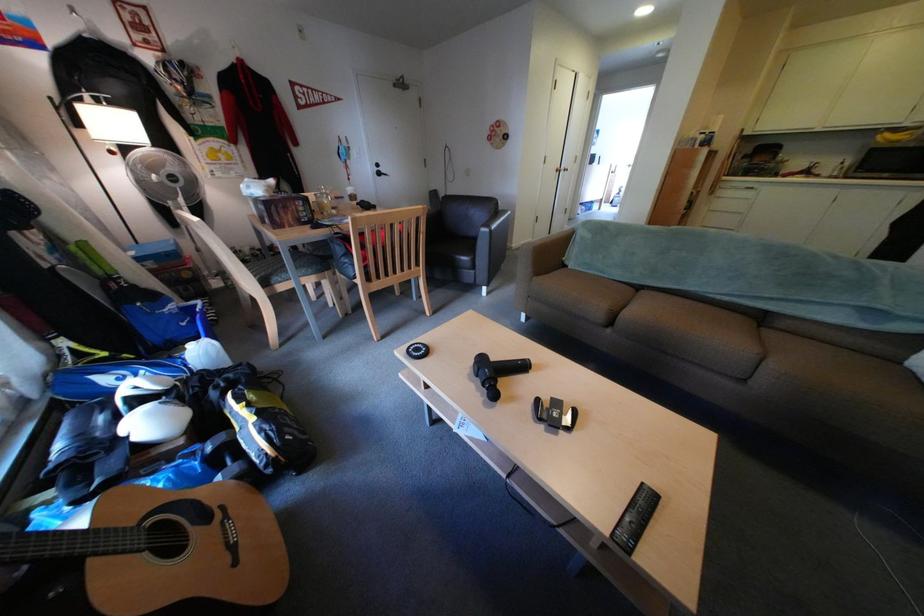
Describe the element at coordinates (566, 278) in the screenshot. I see `a sofa armrest` at that location.